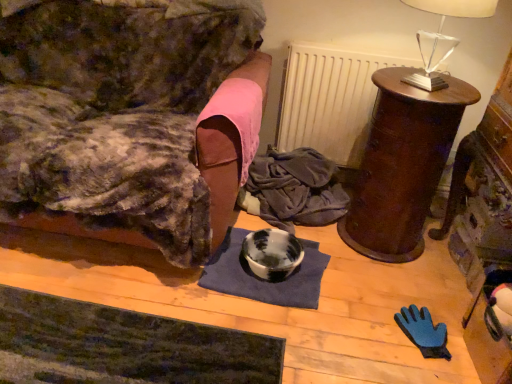
Identify the location of vacant area to the right of blue fabric mat at center. click(362, 278).